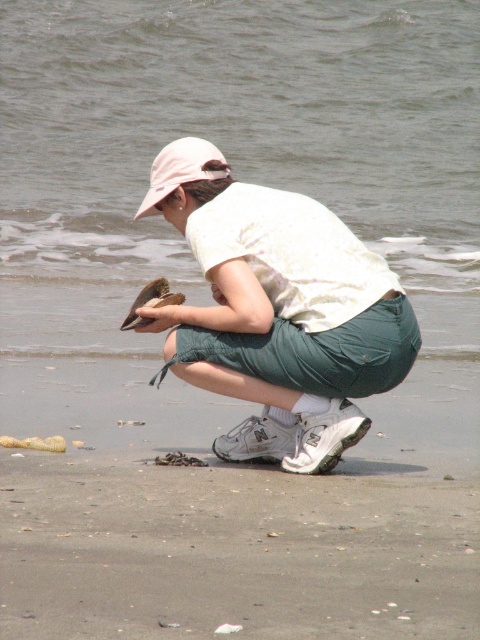
Question: Does white cotton shirt at center have a larger size compared to pink fabric baseball cap at upper center?

Choices:
 (A) no
 (B) yes

Answer: (B)

Question: Which point is farther from the camera taking this photo?

Choices:
 (A) (147, 285)
 (B) (316, 310)
 (C) (207, 152)

Answer: (A)

Question: Considering the relative positions of white cotton shirt at center and pink fabric baseball cap at upper center in the image provided, where is white cotton shirt at center located with respect to pink fabric baseball cap at upper center?

Choices:
 (A) below
 (B) above

Answer: (A)

Question: Which object is farther from the camera taking this photo?

Choices:
 (A) pink fabric baseball cap at upper center
 (B) brown feathered bird at center
 (C) white cotton shirt at center

Answer: (A)

Question: Among these objects, which one is nearest to the camera?

Choices:
 (A) white cotton shirt at center
 (B) pink fabric baseball cap at upper center

Answer: (A)

Question: Is white cotton shirt at center closer to the viewer compared to brown feathered bird at center?

Choices:
 (A) yes
 (B) no

Answer: (A)